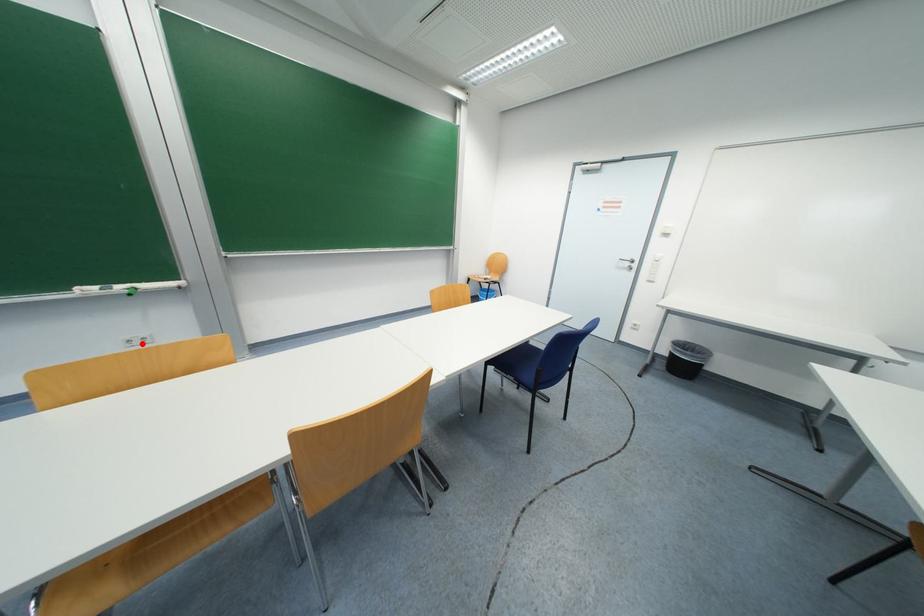
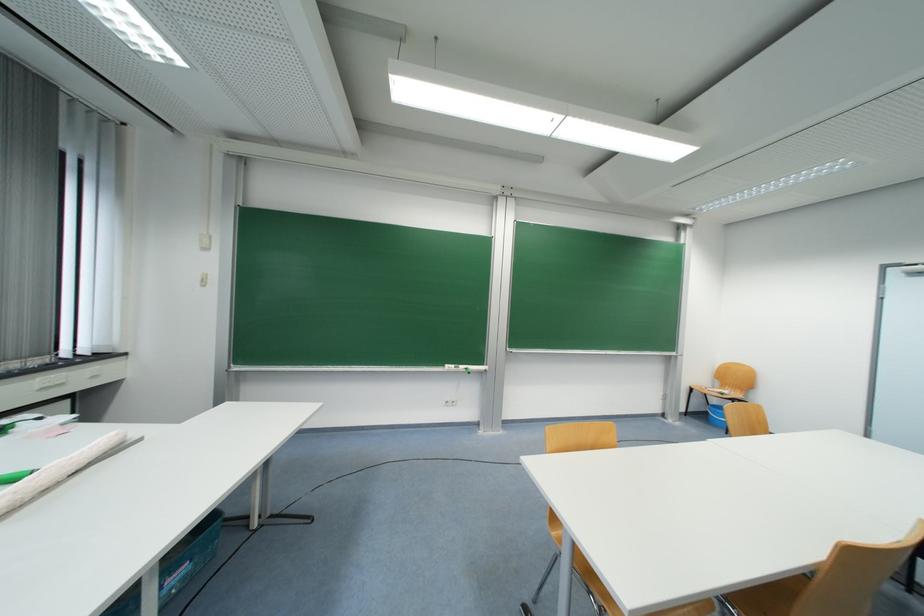
Question: A red point is marked in image1. In image2, is the corresponding 3D point closer to the camera or farther? Reply with the corresponding letter.

Choices:
 (A) The corresponding 3D point is closer.
 (B) The corresponding 3D point is farther.

Answer: (B)